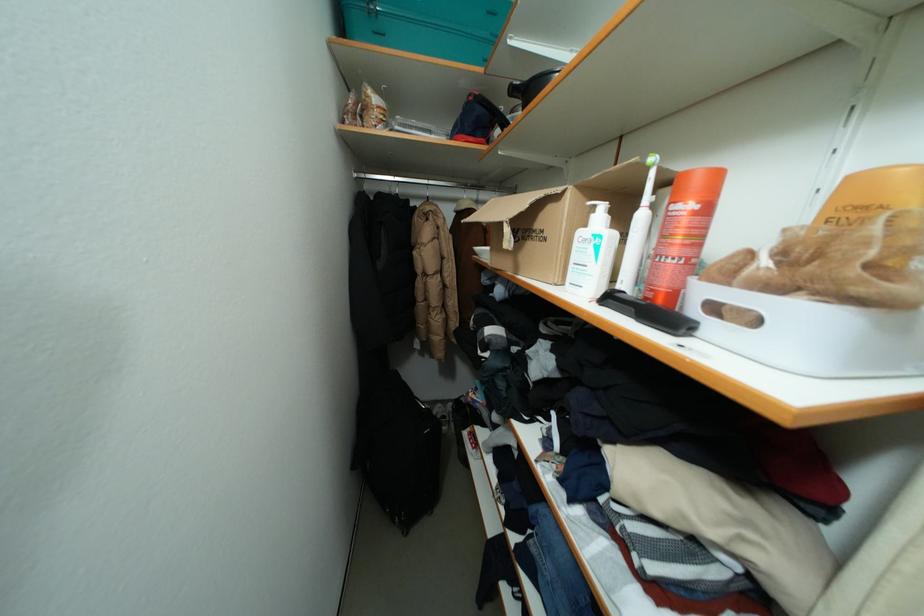
What do you see at coordinates (638, 232) in the screenshot? I see `the electric toothbrush` at bounding box center [638, 232].